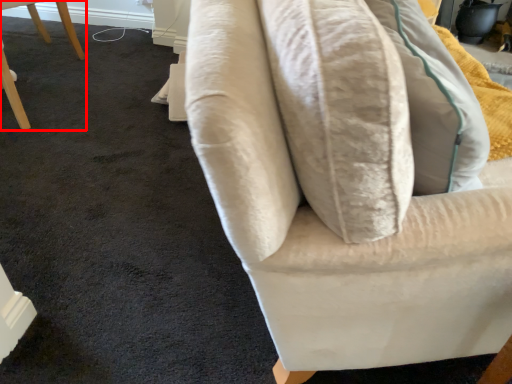
Question: Considering the relative positions of chair (annotated by the red box) and furniture in the image provided, where is chair (annotated by the red box) located with respect to the staircase?

Choices:
 (A) right
 (B) left

Answer: (B)